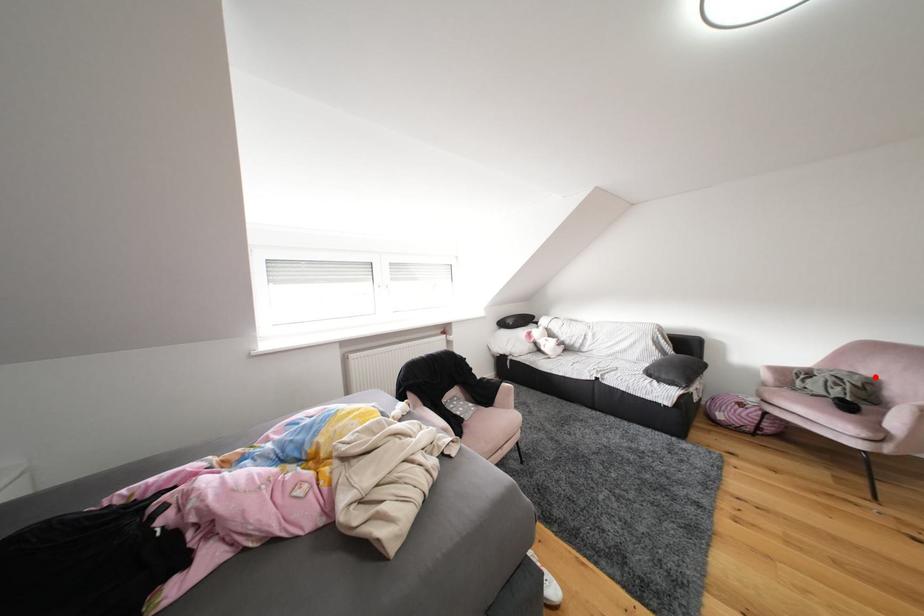
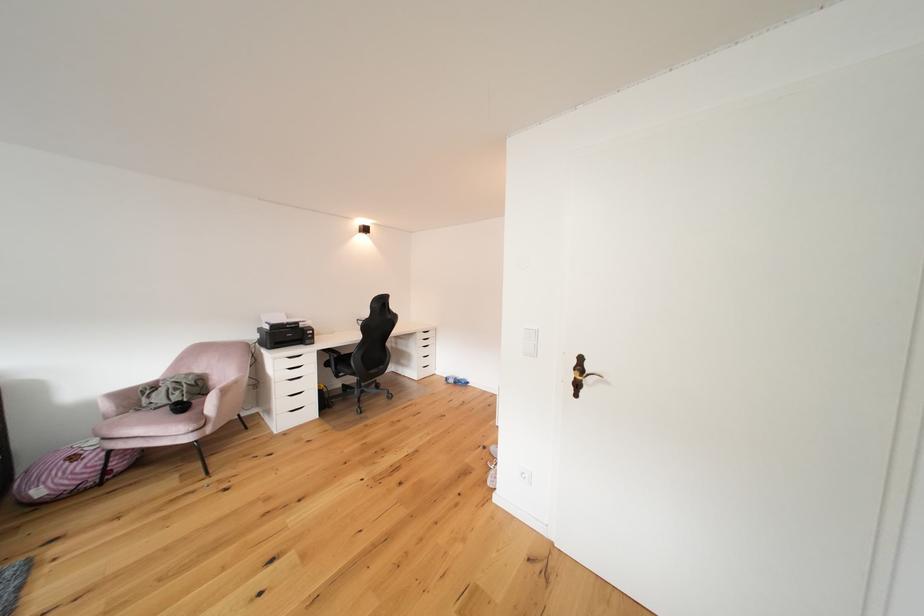
Find the pixel in the second image that matches the highlighted location in the first image.

(208, 374)